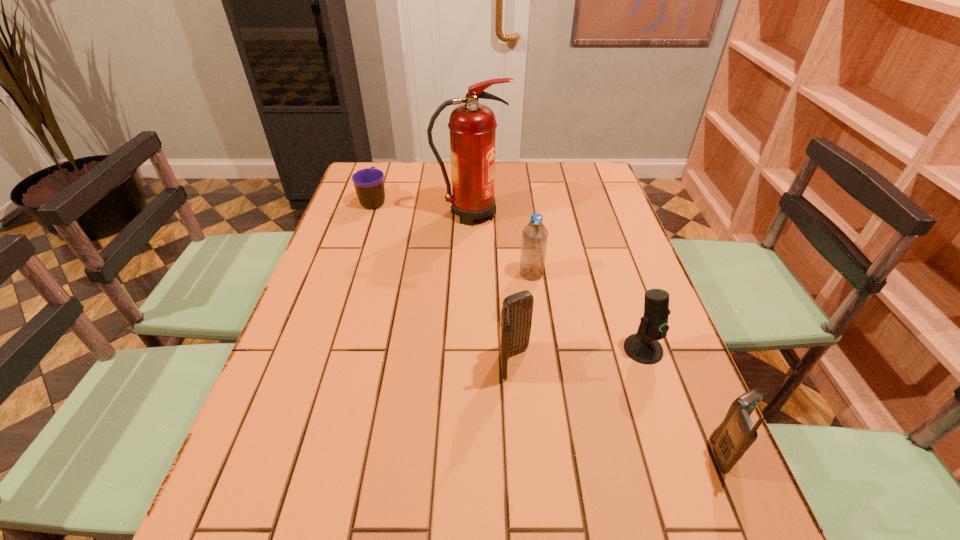
The height and width of the screenshot is (540, 960). Identify the location of unoccupied area between the second object from right to left and the left cellular telephone. (579, 356).

The image size is (960, 540). I want to click on vacant area that lies between the water bottle and the right cellular telephone, so click(x=628, y=363).

This screenshot has height=540, width=960. In order to click on free space between the left cellular telephone and the fire extinguisher in this screenshot , I will do `click(492, 288)`.

Find the location of a particular element. The height and width of the screenshot is (540, 960). blank region between the tallest object and the taller cellular telephone is located at coordinates (492, 288).

I want to click on empty space between the microphone and the fire extinguisher, so click(x=557, y=281).

Identify the location of free space that is in between the taller cellular telephone and the fifth object from left to right. This screenshot has height=540, width=960. (579, 356).

This screenshot has width=960, height=540. Find the location of `vacant area that lies between the left cellular telephone and the nearer cellular telephone`. vacant area that lies between the left cellular telephone and the nearer cellular telephone is located at coordinates (619, 408).

I want to click on free spot between the taller cellular telephone and the fifth object from left to right, so click(579, 356).

Where is `free space between the fire extinguisher and the fifth object from left to right`? The image size is (960, 540). free space between the fire extinguisher and the fifth object from left to right is located at coordinates (557, 281).

Where is `the closest object relative to the nearer cellular telephone`? the closest object relative to the nearer cellular telephone is located at coordinates (643, 347).